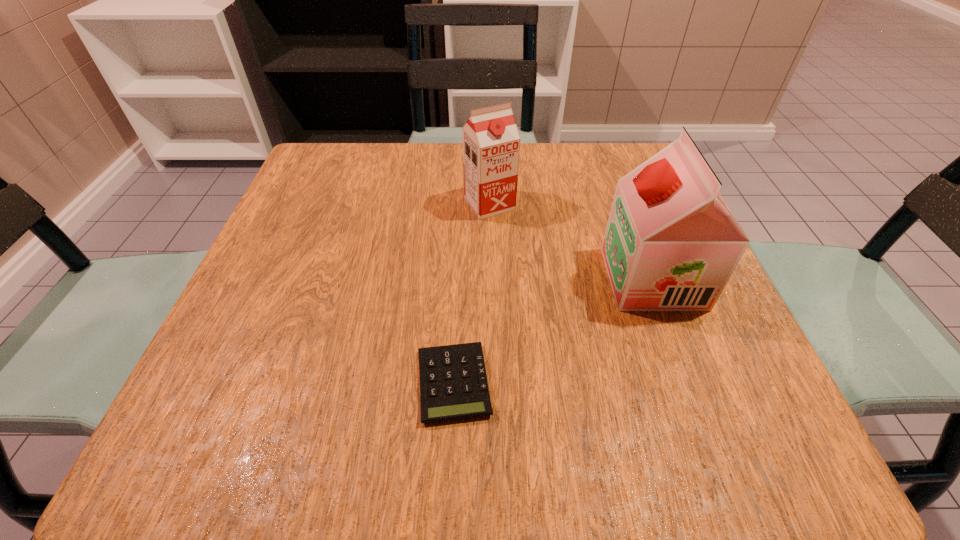
Locate which object ranks in proximity to the shorter soya milk. Please provide its 2D coordinates. Your answer should be formatted as a tuple, i.e. [(x, y)], where the tuple contains the x and y coordinates of a point satisfying the conditions above.

[(671, 243)]

Where is `vacant region that satisfies the following two spatial constraints: 1. with the cap open on the second nearest object; 2. on the front side of the calculator`? The height and width of the screenshot is (540, 960). vacant region that satisfies the following two spatial constraints: 1. with the cap open on the second nearest object; 2. on the front side of the calculator is located at coordinates (692, 383).

You are a GUI agent. You are given a task and a screenshot of the screen. Output one action in this format:
    pyautogui.click(x=<x>, y=<y>)
    Task: Click on the vacant region that satisfies the following two spatial constraints: 1. on the back side of the farthest object; 2. on the right side of the shortest object
    This screenshot has width=960, height=540.
    Given the screenshot: What is the action you would take?
    pyautogui.click(x=462, y=204)